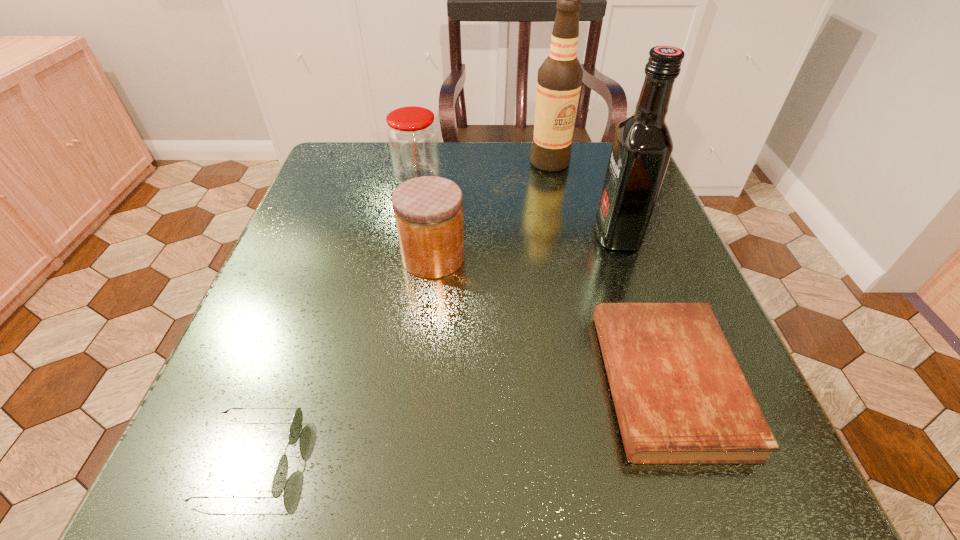
You are a GUI agent. You are given a task and a screenshot of the screen. Output one action in this format:
    pyautogui.click(x=<x>, y=<y>)
    Task: Click on the vacant region located on the front of the farther jar
    
    Given the screenshot: What is the action you would take?
    pyautogui.click(x=406, y=240)

The height and width of the screenshot is (540, 960). Find the location of `free space located 0.180m on the right of the nearer jar`. free space located 0.180m on the right of the nearer jar is located at coordinates (562, 258).

You are a GUI agent. You are given a task and a screenshot of the screen. Output one action in this format:
    pyautogui.click(x=<x>, y=<y>)
    Task: Click on the vacant space located on the spine side of the Bible
    The height and width of the screenshot is (540, 960).
    Given the screenshot: What is the action you would take?
    pyautogui.click(x=334, y=382)

Locate an element on the screen. vacant space located on the spine side of the Bible is located at coordinates tap(411, 382).

The width and height of the screenshot is (960, 540). In order to click on vacant space located 0.190m on the spine side of the Bible in this screenshot , I will do `click(473, 382)`.

The height and width of the screenshot is (540, 960). Identify the location of free space located on the front-facing side of the sunglasses. [x=334, y=458].

Find the location of a particular element. Image resolution: width=960 pixels, height=540 pixels. alcohol that is at the far edge is located at coordinates (559, 80).

What are the coordinates of `jar at the far edge` in the screenshot? It's located at (412, 137).

The image size is (960, 540). Find the location of `Bible present at the near edge`. Bible present at the near edge is located at coordinates (680, 396).

This screenshot has height=540, width=960. I want to click on sunglasses that is at the near edge, so pyautogui.click(x=279, y=481).